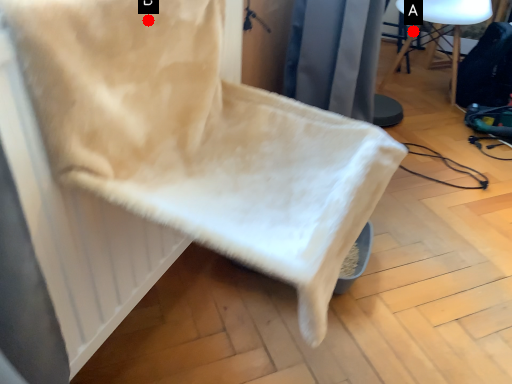
Question: Two points are circled on the image, labeled by A and B beside each circle. Which of the following is the closest to the observer?

Choices:
 (A) A is closer
 (B) B is closer

Answer: (B)